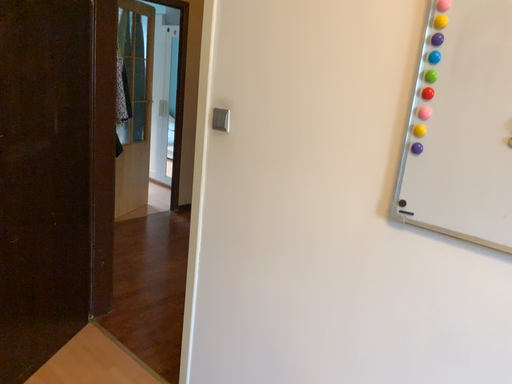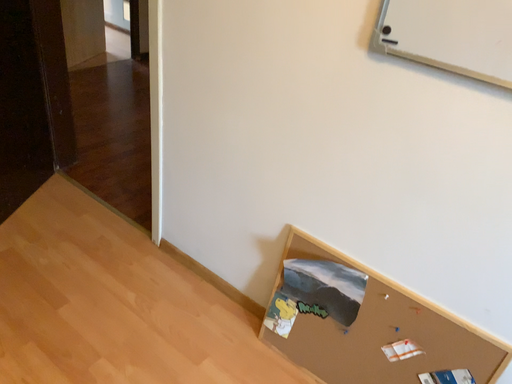
Question: How did the camera likely rotate when shooting the video?

Choices:
 (A) rotated downward
 (B) rotated upward

Answer: (A)